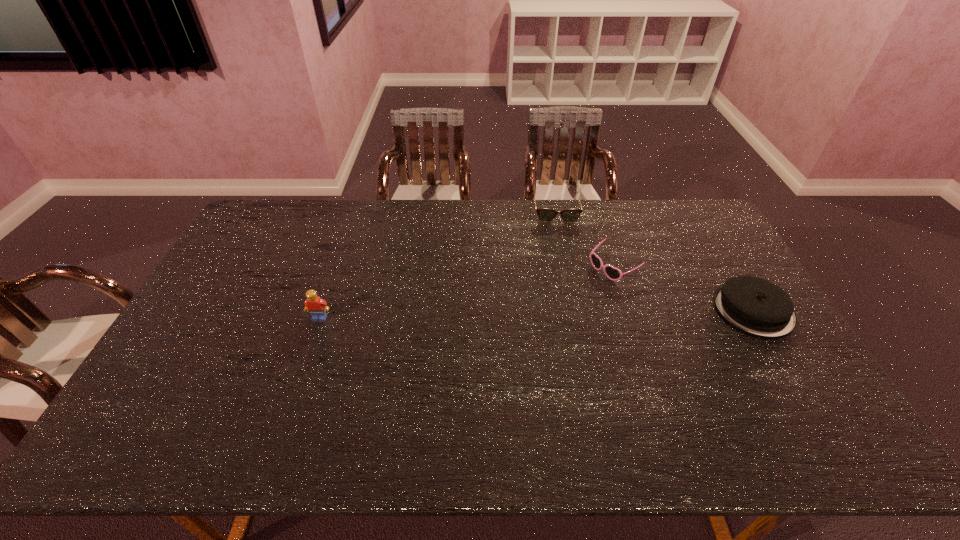
What are the coordinates of `vacant space at the near right corner of the desktop` in the screenshot? It's located at (820, 403).

Locate an element on the screen. Image resolution: width=960 pixels, height=540 pixels. vacant space in between the Lego and the sunglasses is located at coordinates (467, 293).

This screenshot has width=960, height=540. I want to click on vacant space that's between the Lego and the spectacles, so click(438, 265).

Identify the location of unoccupied area between the rightmost object and the farthest object. Image resolution: width=960 pixels, height=540 pixels. (655, 260).

Find the location of `empty space that is in between the sunglasses and the leftmost object`. empty space that is in between the sunglasses and the leftmost object is located at coordinates (467, 293).

The width and height of the screenshot is (960, 540). Identify the location of vacant space that is in between the tallest object and the rightmost object. (537, 314).

This screenshot has height=540, width=960. In order to click on free space that is in between the sunglasses and the tallest object in this screenshot , I will do `click(467, 293)`.

The height and width of the screenshot is (540, 960). What are the coordinates of `free space between the rightmost object and the leftmost object` in the screenshot? It's located at (537, 314).

Find the location of a particular element. vacant area that lies between the rightmost object and the spectacles is located at coordinates click(655, 260).

The height and width of the screenshot is (540, 960). I want to click on vacant space in between the rightmost object and the leftmost object, so click(537, 314).